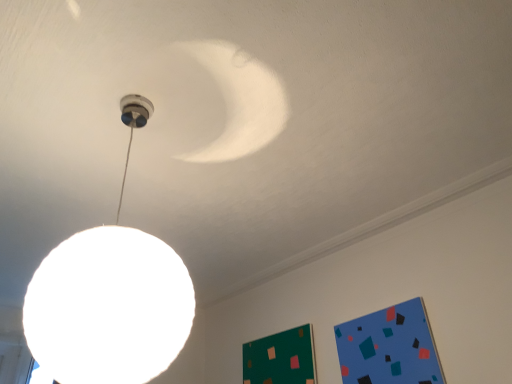
Question: Considering the relative positions of white matte globe lamp at upper center and green matte bulletin board at lower right, placed as the second bulletin board when sorted from right to left, in the image provided, is white matte globe lamp at upper center to the right of green matte bulletin board at lower right, placed as the second bulletin board when sorted from right to left, from the viewer's perspective?

Choices:
 (A) no
 (B) yes

Answer: (A)

Question: Considering the relative sizes of white matte globe lamp at upper center and green matte bulletin board at lower right, the first bulletin board from the back, in the image provided, is white matte globe lamp at upper center thinner than green matte bulletin board at lower right, the first bulletin board from the back,?

Choices:
 (A) yes
 (B) no

Answer: (B)

Question: Does white matte globe lamp at upper center have a smaller size compared to green matte bulletin board at lower right, the 2th bulletin board from the front?

Choices:
 (A) yes
 (B) no

Answer: (B)

Question: From a real-world perspective, is white matte globe lamp at upper center on green matte bulletin board at lower right, the first bulletin board from the back?

Choices:
 (A) yes
 (B) no

Answer: (A)

Question: Does white matte globe lamp at upper center have a lesser height compared to green matte bulletin board at lower right, the first bulletin board from the back?

Choices:
 (A) no
 (B) yes

Answer: (A)

Question: Is white matte ceiling at upper center taller or shorter than white matte globe lamp at upper center?

Choices:
 (A) short
 (B) tall

Answer: (A)

Question: In terms of size, does white matte ceiling at upper center appear bigger or smaller than white matte globe lamp at upper center?

Choices:
 (A) small
 (B) big

Answer: (A)

Question: Looking at their shapes, would you say white matte ceiling at upper center is wider or thinner than white matte globe lamp at upper center?

Choices:
 (A) thin
 (B) wide

Answer: (A)

Question: From the image's perspective, is white matte ceiling at upper center above or below white matte globe lamp at upper center?

Choices:
 (A) above
 (B) below

Answer: (B)

Question: From their relative heights in the image, would you say white matte globe lamp at upper center is taller or shorter than blue matte bulletin board at lower right, which is the 2th bulletin board from left to right?

Choices:
 (A) short
 (B) tall

Answer: (B)

Question: Is white matte globe lamp at upper center inside the boundaries of blue matte bulletin board at lower right, the 1th bulletin board positioned from the right, or outside?

Choices:
 (A) inside
 (B) outside

Answer: (B)

Question: In the image, is white matte globe lamp at upper center positioned in front of or behind blue matte bulletin board at lower right, the 2th bulletin board in the back-to-front sequence?

Choices:
 (A) behind
 (B) front

Answer: (B)

Question: Would you say white matte globe lamp at upper center is to the left or to the right of blue matte bulletin board at lower right, placed as the first bulletin board when sorted from front to back, in the picture?

Choices:
 (A) right
 (B) left

Answer: (B)

Question: Is point (256, 374) closer or farther from the camera than point (143, 97)?

Choices:
 (A) farther
 (B) closer

Answer: (A)

Question: Is green matte bulletin board at lower right, the 2th bulletin board from the front, to the left or to the right of white matte globe lamp at upper center in the image?

Choices:
 (A) right
 (B) left

Answer: (A)